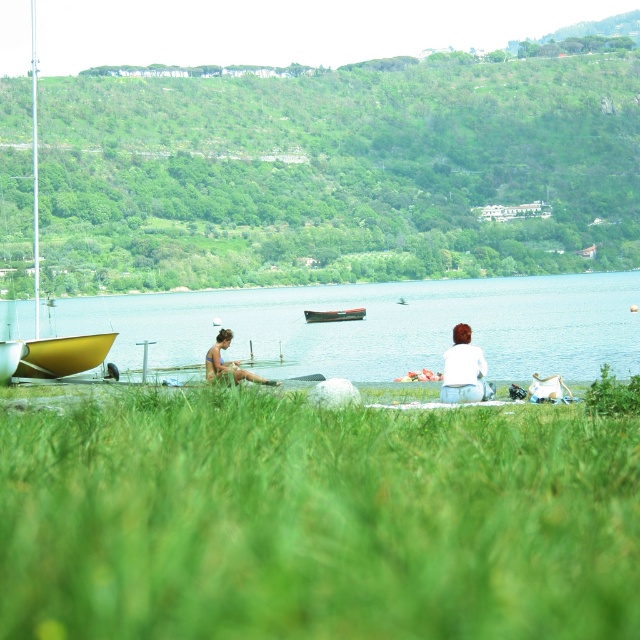
Is yellow matte sailboat at left shorter than white cotton shirt at center?

No, yellow matte sailboat at left is not shorter than white cotton shirt at center.

Which is in front, point (58, 340) or point (481, 365)?

Point (481, 365) is more forward.

Identify the location of yellow matte sailboat at left. The height and width of the screenshot is (640, 640). (38, 305).

Is yellow matte sailboat at left thinner than matte blue swimsuit at center?

Incorrect, yellow matte sailboat at left's width is not less than matte blue swimsuit at center's.

Who is shorter, yellow matte sailboat at left or matte blue swimsuit at center?

matte blue swimsuit at center

Is point (81, 358) closer to viewer compared to point (216, 353)?

No.

Find the location of `yellow matte sailboat at left`. yellow matte sailboat at left is located at coordinates (38, 305).

Consider the image. Does blue water at center lie behind yellow matte sailboat at left?

That is False.

Is blue water at center wider than yellow matte sailboat at left?

Correct, the width of blue water at center exceeds that of yellow matte sailboat at left.

Does point (577, 332) come behind point (92, 352)?

Yes, point (577, 332) is farther from viewer.

Find the location of a particular element. Image resolution: width=640 pixels, height=640 pixels. blue water at center is located at coordinates (376, 326).